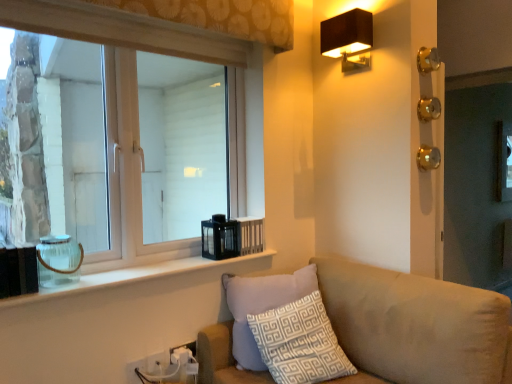
Question: Considering the relative sizes of clear glass jar at left and white patterned cushion at lower center in the image provided, is clear glass jar at left shorter than white patterned cushion at lower center?

Choices:
 (A) no
 (B) yes

Answer: (B)

Question: From the image's perspective, is clear glass jar at left below white patterned cushion at lower center?

Choices:
 (A) yes
 (B) no

Answer: (B)

Question: Is clear glass jar at left thinner than white patterned cushion at lower center?

Choices:
 (A) no
 (B) yes

Answer: (B)

Question: Is clear glass jar at left at the right side of white patterned cushion at lower center?

Choices:
 (A) no
 (B) yes

Answer: (A)

Question: Does clear glass jar at left have a larger size compared to white patterned cushion at lower center?

Choices:
 (A) yes
 (B) no

Answer: (B)

Question: From a real-world perspective, is clear glass window at upper left above or below white plastic electric outlet at lower center, which is the first electric outlet in back-to-front order?

Choices:
 (A) below
 (B) above

Answer: (B)

Question: Is point (120, 96) positioned closer to the camera than point (183, 345)?

Choices:
 (A) closer
 (B) farther

Answer: (A)

Question: Choose the correct answer: Is clear glass window at upper left inside white plastic electric outlet at lower center, which is the first electric outlet in back-to-front order, or outside it?

Choices:
 (A) outside
 (B) inside

Answer: (A)

Question: Considering the positions of clear glass window at upper left and white plastic electric outlet at lower center, which is the first electric outlet in back-to-front order, in the image, is clear glass window at upper left wider or thinner than white plastic electric outlet at lower center, which is the first electric outlet in back-to-front order,?

Choices:
 (A) wide
 (B) thin

Answer: (A)

Question: Considering the positions of point (441, 367) and point (361, 59), is point (441, 367) closer or farther from the camera than point (361, 59)?

Choices:
 (A) farther
 (B) closer

Answer: (B)

Question: From the image's perspective, is beige fabric couch at lower right located above or below black fabric lampshade at upper right?

Choices:
 (A) below
 (B) above

Answer: (A)

Question: In terms of width, does beige fabric couch at lower right look wider or thinner when compared to black fabric lampshade at upper right?

Choices:
 (A) thin
 (B) wide

Answer: (B)

Question: Based on their positions, is beige fabric couch at lower right located to the left or right of black fabric lampshade at upper right?

Choices:
 (A) left
 (B) right

Answer: (A)

Question: From a real-world perspective, is clear glass jar at lower left physically located above or below white plastic electric outlet at lower center, placed as the second electric outlet when sorted from back to front?

Choices:
 (A) below
 (B) above

Answer: (B)

Question: Considering the positions of clear glass jar at lower left and white plastic electric outlet at lower center, the 2th electric outlet in the left-to-right sequence, in the image, is clear glass jar at lower left bigger or smaller than white plastic electric outlet at lower center, the 2th electric outlet in the left-to-right sequence,?

Choices:
 (A) big
 (B) small

Answer: (A)